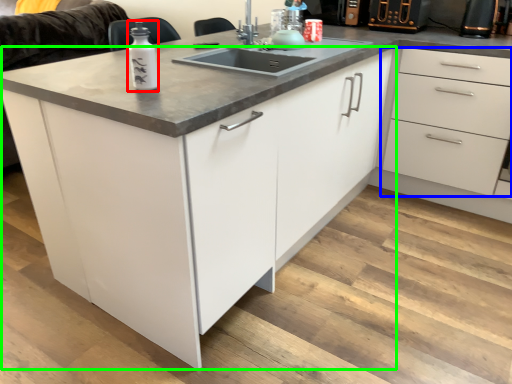
Question: Based on their relative distances, which object is farther from bottle (highlighted by a red box)? Choose from drawer (highlighted by a blue box) and cabinetry (highlighted by a green box).

Choices:
 (A) drawer
 (B) cabinetry

Answer: (A)